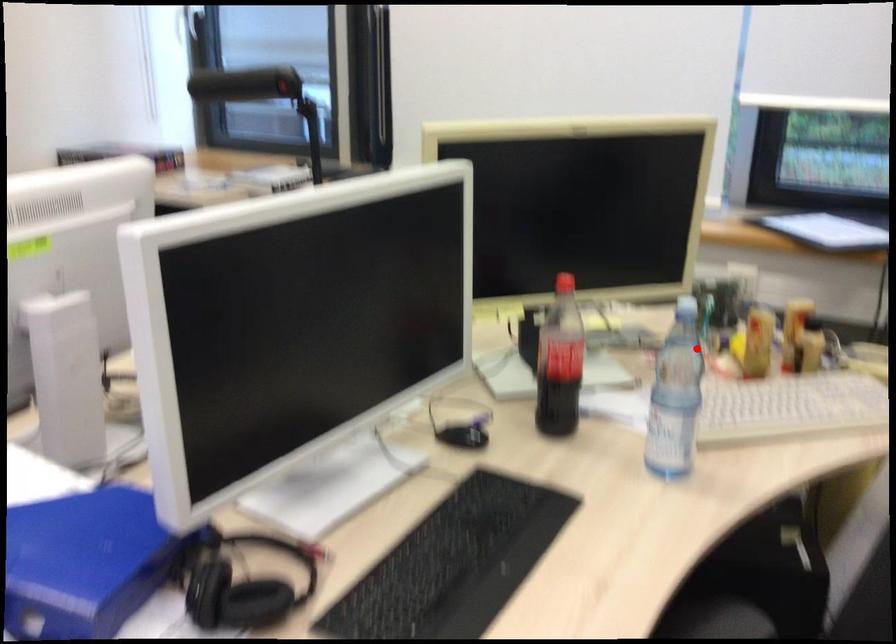
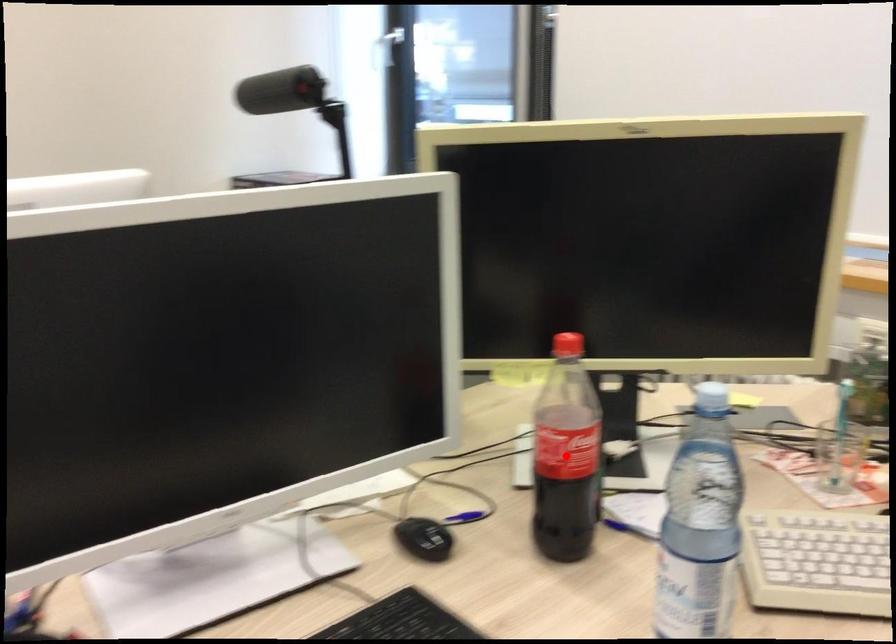
I am providing you with two images of the same scene from different viewpoints. A red point is marked on the first image and another point is marked on the second image. Is the red point in image1 aligned with the point shown in image2?

No